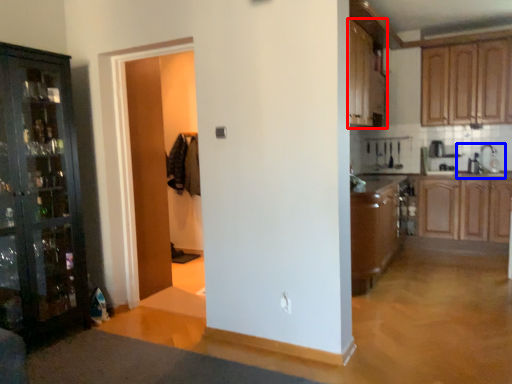
Question: Which object is closer to the camera taking this photo, cabinetry (highlighted by a red box) or sink (highlighted by a blue box)?

Choices:
 (A) cabinetry
 (B) sink

Answer: (A)